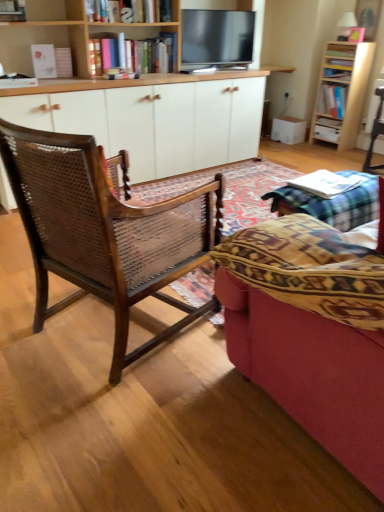
Image resolution: width=384 pixels, height=512 pixels. What do you see at coordinates (332, 100) in the screenshot?
I see `hardcover book at upper right, which is the 2th book in back-to-front order` at bounding box center [332, 100].

What do you see at coordinates (216, 38) in the screenshot?
I see `flat screen tv at upper center` at bounding box center [216, 38].

Locate an element on the screen. This screenshot has height=512, width=384. wooden bookcase at upper right, marked as the 1th bookcase in a back-to-front arrangement is located at coordinates (342, 91).

The width and height of the screenshot is (384, 512). Describe the element at coordinates (327, 133) in the screenshot. I see `white glossy drawer at center` at that location.

What do you see at coordinates (329, 122) in the screenshot? Image resolution: width=384 pixels, height=512 pixels. I see `hardcover book at upper right, which ranks as the 2th book in bottom-to-top order` at bounding box center [329, 122].

Where is `hardcover book at upper right, arranged as the third book when ordered from the bottom`? hardcover book at upper right, arranged as the third book when ordered from the bottom is located at coordinates tap(332, 100).

The width and height of the screenshot is (384, 512). Find the location of `book that is the 1st object located above the velvet red couch at lower right (from the image's perspective)`. book that is the 1st object located above the velvet red couch at lower right (from the image's perspective) is located at coordinates (325, 183).

Is white paper book at center, the 3th book when ordered from right to left, in front of or behind velvet red couch at lower right in the image?

white paper book at center, the 3th book when ordered from right to left, is behind velvet red couch at lower right.

Based on the photo, is white paper book at center, which is counted as the 1th book, starting from the left, to the left of velvet red couch at lower right from the viewer's perspective?

No, white paper book at center, which is counted as the 1th book, starting from the left, is not to the left of velvet red couch at lower right.

From a real-world perspective, is white paper book at center, the 3th book when ordered from right to left, positioned under velvet red couch at lower right based on gravity?

No, from a real-world perspective, white paper book at center, the 3th book when ordered from right to left, is not under velvet red couch at lower right.

Is flat screen tv at upper center directly adjacent to wooden bookshelf at upper center, the second bookcase positioned from the back?

No, flat screen tv at upper center is not touching wooden bookshelf at upper center, the second bookcase positioned from the back.

Can you confirm if flat screen tv at upper center is thinner than wooden bookshelf at upper center, the second bookcase positioned from the back?

Yes, flat screen tv at upper center is thinner than wooden bookshelf at upper center, the second bookcase positioned from the back.

Between flat screen tv at upper center and wooden bookshelf at upper center, which appears as the second bookcase when viewed from the right, which one has larger size?

Bigger between the two is wooden bookshelf at upper center, which appears as the second bookcase when viewed from the right.

Is point (194, 64) behind point (19, 49)?

Yes, point (194, 64) is farther from viewer.

In terms of height, does white wood cabinet at center look taller or shorter compared to wooden bookcase at upper right, acting as the 2th bookcase starting from the left?

white wood cabinet at center is shorter than wooden bookcase at upper right, acting as the 2th bookcase starting from the left.

What's the angular difference between white wood cabinet at center and wooden bookcase at upper right, marked as the second bookcase in a front-to-back arrangement,'s facing directions?

They differ by 85.9 degrees in their facing directions.

Is white wood cabinet at center far away from wooden bookcase at upper right, acting as the 2th bookcase starting from the left?

Indeed, white wood cabinet at center is not near wooden bookcase at upper right, acting as the 2th bookcase starting from the left.

Which point is more forward, (x=249, y=83) or (x=319, y=87)?

The point (x=249, y=83) is more forward.

Can you confirm if wooden bookshelf at upper center, which is the first bookcase from front to back, is taller than white paper book at center, which is counted as the 1th book, starting from the left?

Indeed, wooden bookshelf at upper center, which is the first bookcase from front to back, has a greater height compared to white paper book at center, which is counted as the 1th book, starting from the left.

Does wooden bookshelf at upper center, which is the first bookcase from front to back, turn towards white paper book at center, acting as the first book starting from the bottom?

No, wooden bookshelf at upper center, which is the first bookcase from front to back, is not facing towards white paper book at center, acting as the first book starting from the bottom.

From a real-world perspective, does wooden bookshelf at upper center, which is the 1th bookcase in left-to-right order, sit lower than white paper book at center, the 3th book when ordered from right to left?

Incorrect, from a real-world perspective, wooden bookshelf at upper center, which is the 1th bookcase in left-to-right order, is higher than white paper book at center, the 3th book when ordered from right to left.

Does point (124, 27) appear closer or farther from the camera than point (324, 130)?

Clearly, point (124, 27) is closer to the camera than point (324, 130).

Which object is positioned more to the left, wooden bookshelf at upper center, the second bookcase positioned from the back, or white glossy drawer at center?

wooden bookshelf at upper center, the second bookcase positioned from the back.

Is wooden bookshelf at upper center, which is the 1th bookcase in left-to-right order, not within white glossy drawer at center?

Indeed, wooden bookshelf at upper center, which is the 1th bookcase in left-to-right order, is completely outside white glossy drawer at center.

What's the angular difference between wooden bookshelf at upper center, the second bookcase positioned from the back, and white glossy drawer at center's facing directions?

87 degrees.

Does hardcover book at upper right, which is the 1th book in right-to-left order, appear on the right side of white paper book at center, the 3th book when ordered from right to left?

Indeed, hardcover book at upper right, which is the 1th book in right-to-left order, is positioned on the right side of white paper book at center, the 3th book when ordered from right to left.

From the picture: Choose the correct answer: Is hardcover book at upper right, the 2th book from the front, inside white paper book at center, which is counted as the 1th book, starting from the left, or outside it?

hardcover book at upper right, the 2th book from the front, is located beyond the bounds of white paper book at center, which is counted as the 1th book, starting from the left.

From the image's perspective, starting from the white paper book at center, the 3th book in the top-to-bottom sequence, which book is the 2nd one above? Please provide its 2D coordinates.

[(332, 100)]

Is point (329, 104) positioned before point (313, 179)?

No, (329, 104) is further to viewer.

Is wooden bookshelf at upper center, which is the first bookcase from front to back, oriented towards white wood cabinet at center?

No, wooden bookshelf at upper center, which is the first bookcase from front to back, is not oriented towards white wood cabinet at center.

Is point (24, 42) more distant than point (117, 123)?

Yes, point (24, 42) is behind point (117, 123).

From the image's perspective, which one is positioned lower, wooden bookshelf at upper center, the second bookcase positioned from the back, or white wood cabinet at center?

white wood cabinet at center.

From a real-world perspective, which book is the 1st one above the velvet red couch at lower right? Please provide its 2D coordinates.

[(325, 183)]

What are the coordinates of `bookcase that is on the left side of flat screen tv at upper center` in the screenshot? It's located at (70, 33).

When comparing their distances from wooden bookshelf at upper center, the second bookcase positioned from the back, does hardcover book at upper right, arranged as the first book when viewed from the top, or white paper book at center, which is counted as the 1th book, starting from the left, seem closer?

Based on the image, white paper book at center, which is counted as the 1th book, starting from the left, appears to be nearer to wooden bookshelf at upper center, the second bookcase positioned from the back.

Estimate the real-world distances between objects in this image. Which object is further from flat screen tv at upper center, wooden bookshelf at upper center, which is the 1th bookcase in left-to-right order, or white wood cabinet at center?

A: Among the two, wooden bookshelf at upper center, which is the 1th bookcase in left-to-right order, is located further to flat screen tv at upper center.

Which object lies further to the anchor point wooden cane chair at left, white glossy drawer at center or flat screen tv at upper center?

white glossy drawer at center is further to wooden cane chair at left.

From the image, which object appears to be nearer to hardcover book at upper right, which is the 1th book in right-to-left order, velvet red couch at lower right or white glossy drawer at center?

white glossy drawer at center.

Estimate the real-world distances between objects in this image. Which object is closer to wooden bookcase at upper right, marked as the second bookcase in a front-to-back arrangement, hardcover book at upper right, which ranks as the third book in front-to-back order, or velvet red couch at lower right?

The object closer to wooden bookcase at upper right, marked as the second bookcase in a front-to-back arrangement, is hardcover book at upper right, which ranks as the third book in front-to-back order.

Looking at the image, which one is located further to white paper book at center, the 3th book when ordered from right to left, white wood cabinet at center or flat screen tv at upper center?

flat screen tv at upper center is further to white paper book at center, the 3th book when ordered from right to left.

Based on their spatial positions, is wooden bookcase at upper right, marked as the 1th bookcase in a back-to-front arrangement, or flat screen tv at upper center closer to white paper book at center, which is counted as the 1th book, starting from the left?

Among the two, flat screen tv at upper center is located nearer to white paper book at center, which is counted as the 1th book, starting from the left.

Looking at this image, based on their spatial positions, is wooden bookcase at upper right, acting as the 2th bookcase starting from the left, or flat screen tv at upper center closer to wooden table at lower right?

flat screen tv at upper center is positioned closer to the anchor wooden table at lower right.

Where is `table that lies between wooden bookshelf at upper center, which is the first bookcase from front to back, and wooden cane chair at left from top to bottom`? This screenshot has width=384, height=512. table that lies between wooden bookshelf at upper center, which is the first bookcase from front to back, and wooden cane chair at left from top to bottom is located at coordinates (331, 203).

The image size is (384, 512). I want to click on book between wooden cane chair at left and wooden bookcase at upper right, marked as the second bookcase in a front-to-back arrangement, in the front-back direction, so click(x=325, y=183).

You are a GUI agent. You are given a task and a screenshot of the screen. Output one action in this format:
    pyautogui.click(x=<x>, y=<y>)
    Task: Click on the cabinetry between wooden cane chair at left and flat screen tv at upper center along the z-axis
    The width and height of the screenshot is (384, 512).
    Given the screenshot: What is the action you would take?
    pyautogui.click(x=156, y=122)

What are the coordinates of `book positioned between wooden cane chair at left and flat screen tv at upper center from near to far` in the screenshot? It's located at (325, 183).